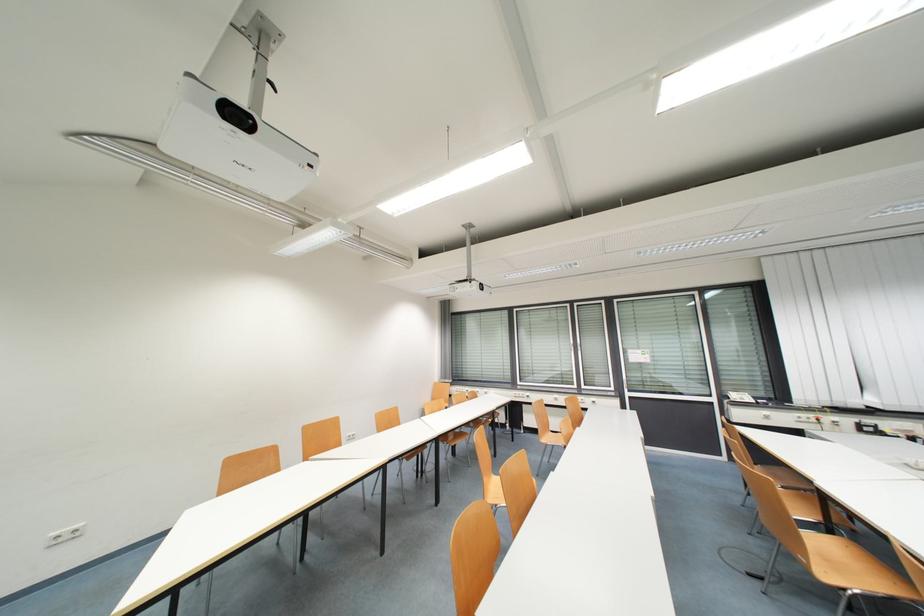
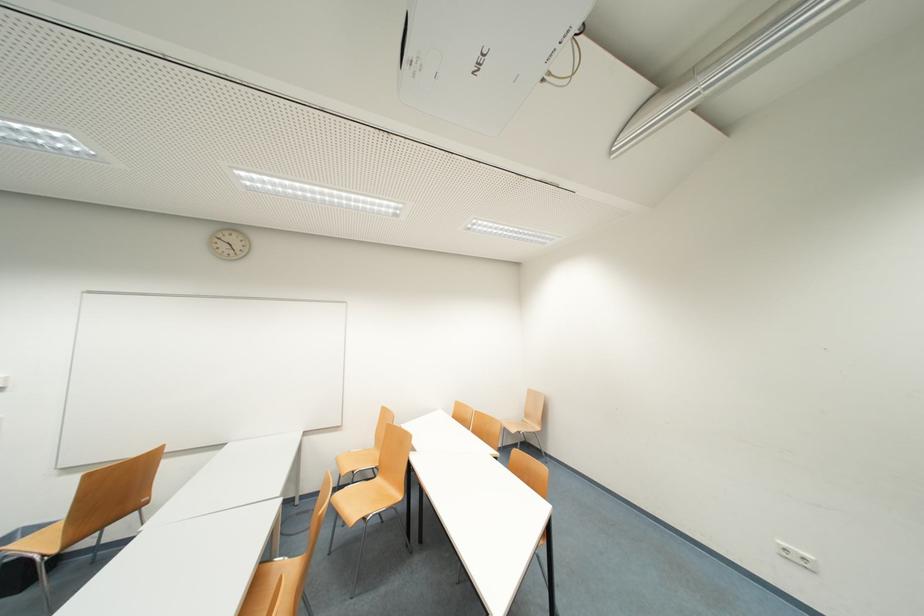
Find the pixel in the second image that matches the point at 62,535 in the first image.

(788, 546)